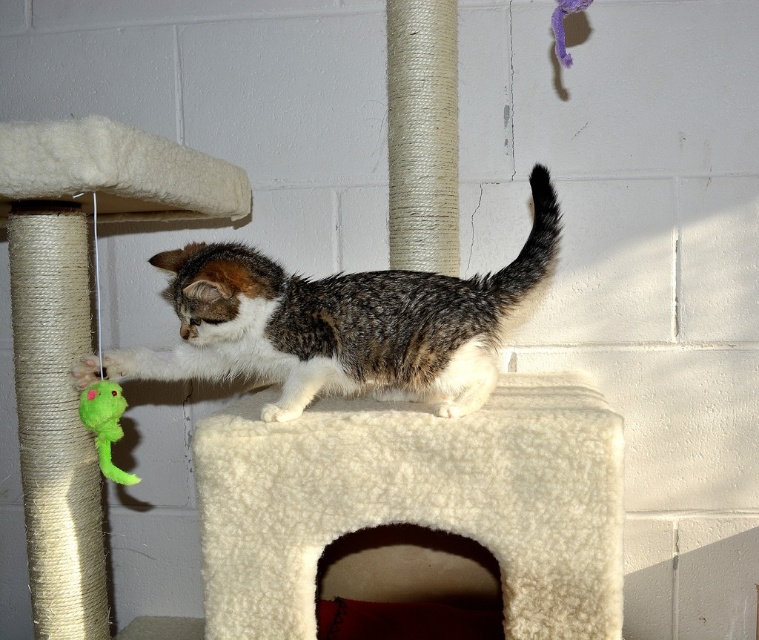
You are a cat owner who wants to place a new toy on the white fluffy cat bed at center. However, the calico fur cat at center is currently sitting on the bed. Can you easily access the bed to place the toy without disturbing the cat?

The white fluffy cat bed at center is closer to the viewer than calico fur cat at center, so you can reach the bed from your position without needing to move the cat.

You are a cat owner who wants to ensure your calico fur cat at center has a comfortable place to rest. Is the white fluffy cat bed at center positioned in a way that the cat can easily access it?

The white fluffy cat bed at center is located below calico fur cat at center, so yes, the cat can easily step down onto the bed from its current position.

You are a cat owner who wants to place a new cat tree in your living room. The cat tree has a white fluffy cat bed at center and a green plush toy at lower left. Based on the image, which object is positioned to the right of the other?

The white fluffy cat bed at center is positioned to the right of the green plush toy at lower left.